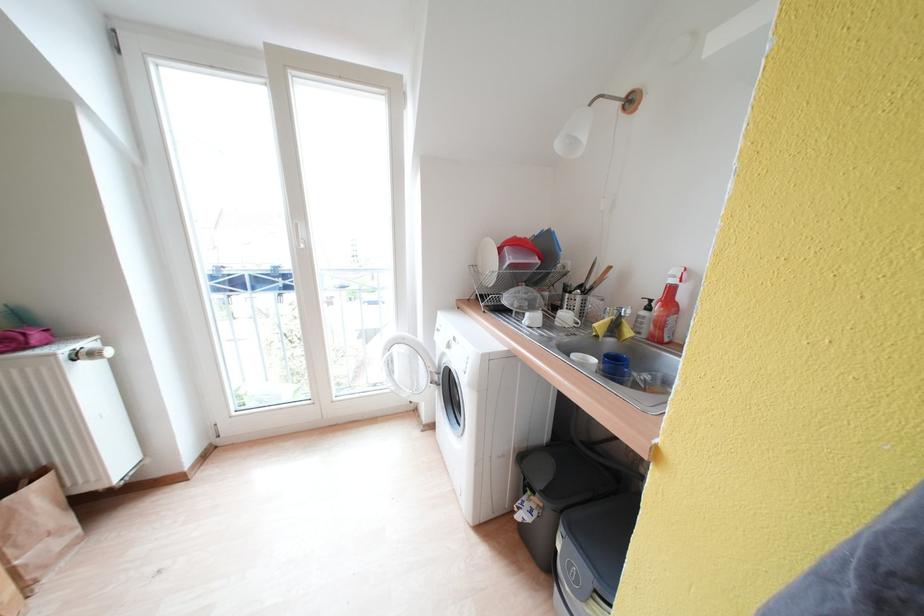
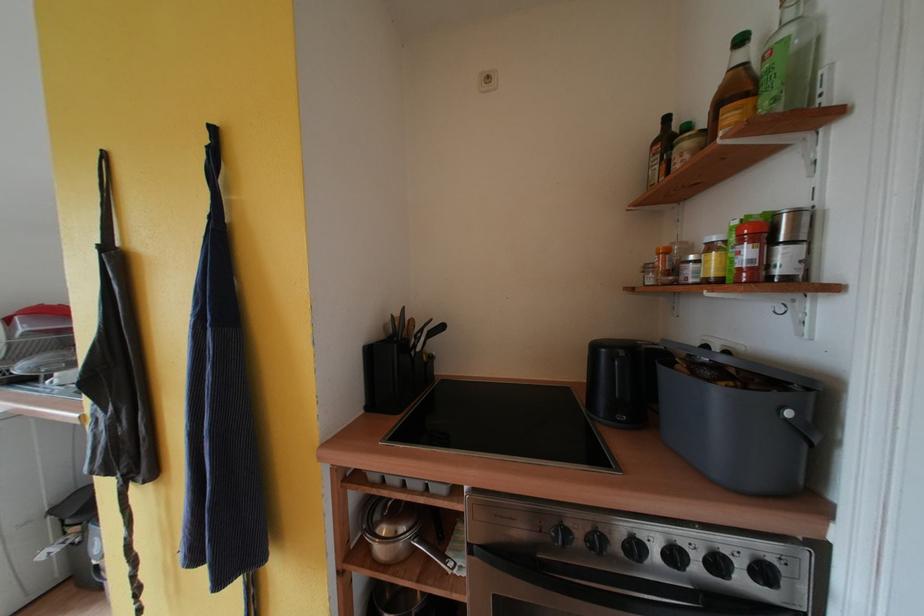
In the second image, find the point that corresponds to (x=551, y=496) in the first image.

(83, 517)